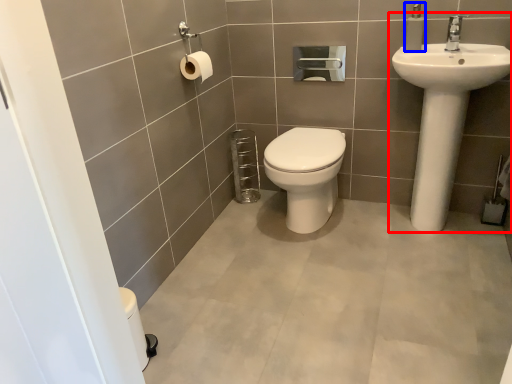
Question: Among these objects, which one is farthest to the camera, sink (highlighted by a red box) or soap dispenser (highlighted by a blue box)?

Choices:
 (A) sink
 (B) soap dispenser

Answer: (B)